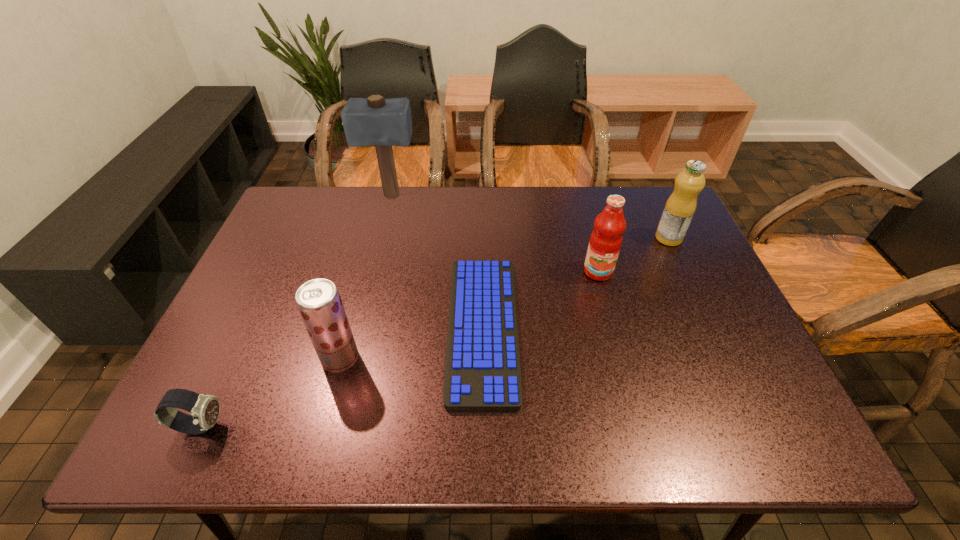
Locate an element on the screen. This screenshot has height=540, width=960. computer keyboard is located at coordinates (482, 370).

You are a GUI agent. You are given a task and a screenshot of the screen. Output one action in this format:
    pyautogui.click(x=<x>, y=<y>)
    Task: Click on the vacant space situated 0.370m on the right of the farthest object
    This screenshot has width=960, height=540.
    Given the screenshot: What is the action you would take?
    pyautogui.click(x=532, y=197)

The height and width of the screenshot is (540, 960). Find the location of `vacant space situated on the front label of the fifth nearest object`. vacant space situated on the front label of the fifth nearest object is located at coordinates (590, 238).

Locate an element on the screen. The height and width of the screenshot is (540, 960). vacant space positioned 0.210m on the front label of the fifth nearest object is located at coordinates (584, 238).

Image resolution: width=960 pixels, height=540 pixels. In order to click on free spot located 0.300m on the front label of the fifth nearest object in this screenshot , I will do `click(553, 238)`.

Image resolution: width=960 pixels, height=540 pixels. I want to click on vacant space located on the front label of the second farthest fruit juice, so click(628, 381).

I want to click on free space located 0.280m on the right of the nearest fruit juice, so click(483, 359).

The height and width of the screenshot is (540, 960). In order to click on vacant space located 0.330m on the face of the leftmost object in this screenshot , I will do `click(390, 426)`.

Where is `vacant space located 0.170m on the right of the fourth object from left to right`? vacant space located 0.170m on the right of the fourth object from left to right is located at coordinates (588, 328).

Identify the location of mallet that is at the far edge. (370, 121).